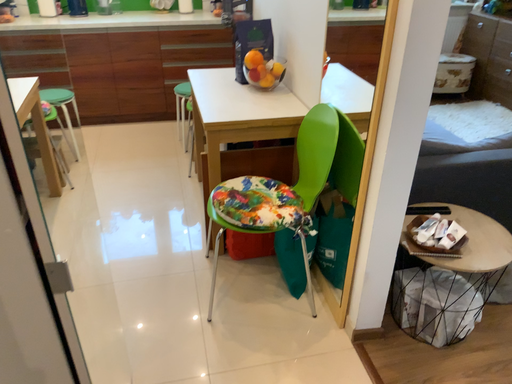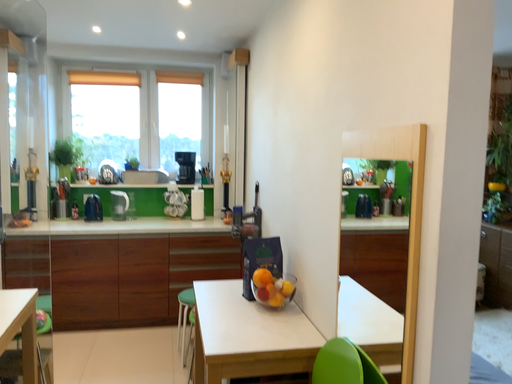
Question: How did the camera likely rotate when shooting the video?

Choices:
 (A) rotated upward
 (B) rotated downward

Answer: (A)